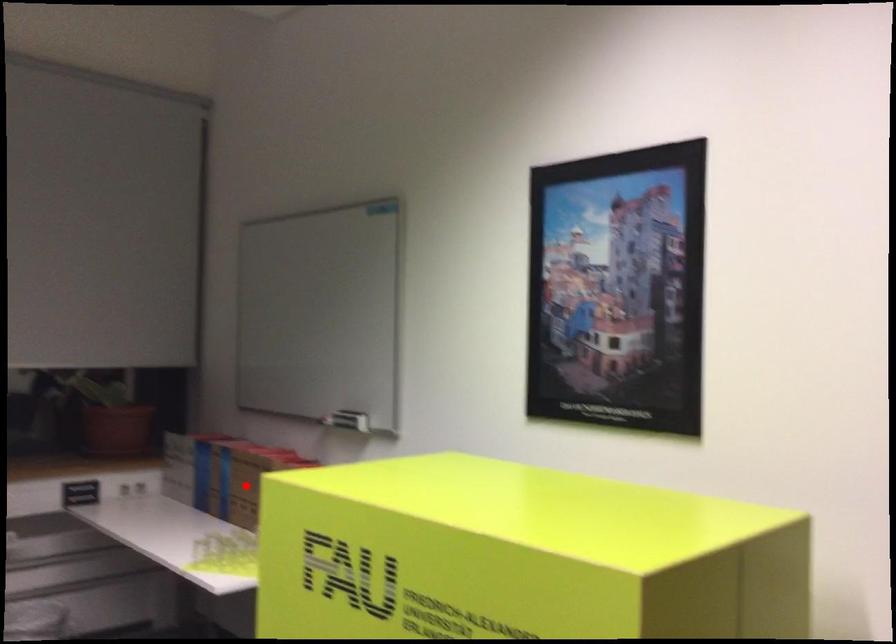
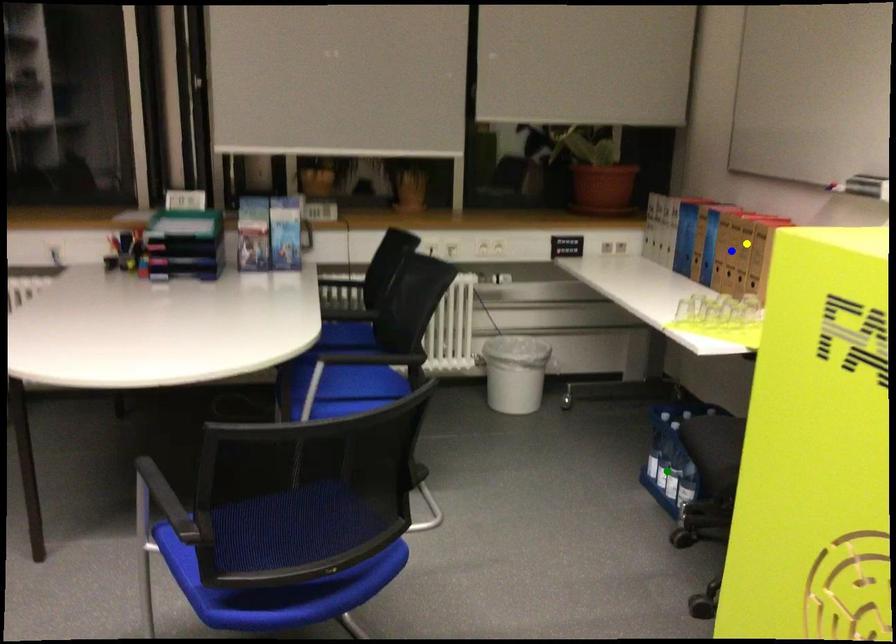
Question: I am providing you with two images of the same scene from different viewpoints. A red point is marked on the first image. You are given multiple points on the second image. In image 2, which mark is for the same physical point as the one in image 1?

Choices:
 (A) blue point
 (B) yellow point
 (C) green point

Answer: (A)